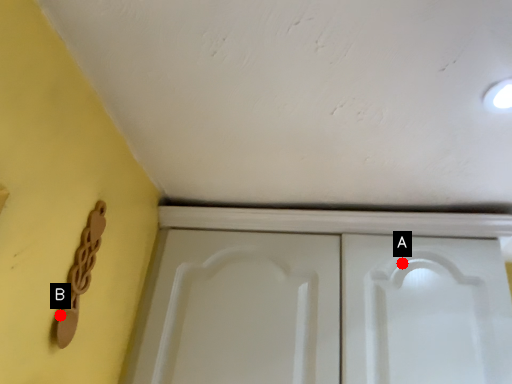
Question: Two points are circled on the image, labeled by A and B beside each circle. Which point is closer to the camera?

Choices:
 (A) A is closer
 (B) B is closer

Answer: (B)